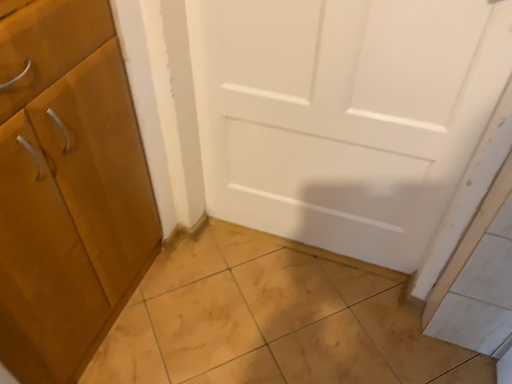
Question: Is matte wood cabinet at left looking in the opposite direction of light brown tile at lower left?

Choices:
 (A) no
 (B) yes

Answer: (A)

Question: Can you confirm if matte wood cabinet at left is shorter than light brown tile at lower left?

Choices:
 (A) yes
 (B) no

Answer: (B)

Question: Considering the relative sizes of matte wood cabinet at left and light brown tile at lower left in the image provided, is matte wood cabinet at left smaller than light brown tile at lower left?

Choices:
 (A) no
 (B) yes

Answer: (A)

Question: Does matte wood cabinet at left appear on the right side of light brown tile at lower left?

Choices:
 (A) no
 (B) yes

Answer: (A)

Question: Is light brown tile at lower left surrounded by matte wood cabinet at left?

Choices:
 (A) yes
 (B) no

Answer: (B)

Question: From a real-world perspective, does matte wood cabinet at left stand above light brown tile at lower left?

Choices:
 (A) yes
 (B) no

Answer: (A)

Question: Does light brown tile at lower left come behind matte wood cabinet at left?

Choices:
 (A) no
 (B) yes

Answer: (B)

Question: Considering the relative sizes of light brown tile at lower left and matte wood cabinet at left in the image provided, is light brown tile at lower left bigger than matte wood cabinet at left?

Choices:
 (A) no
 (B) yes

Answer: (A)

Question: From a real-world perspective, is light brown tile at lower left under matte wood cabinet at left?

Choices:
 (A) yes
 (B) no

Answer: (A)

Question: Is matte wood cabinet at left at the back of light brown tile at lower left?

Choices:
 (A) no
 (B) yes

Answer: (A)

Question: Can you see light brown tile at lower left touching matte wood cabinet at left?

Choices:
 (A) no
 (B) yes

Answer: (A)

Question: Can you confirm if light brown tile at lower left is taller than matte wood cabinet at left?

Choices:
 (A) no
 (B) yes

Answer: (A)

Question: Is matte wood cabinet at left in front of or behind light brown tile at lower left in the image?

Choices:
 (A) front
 (B) behind

Answer: (A)